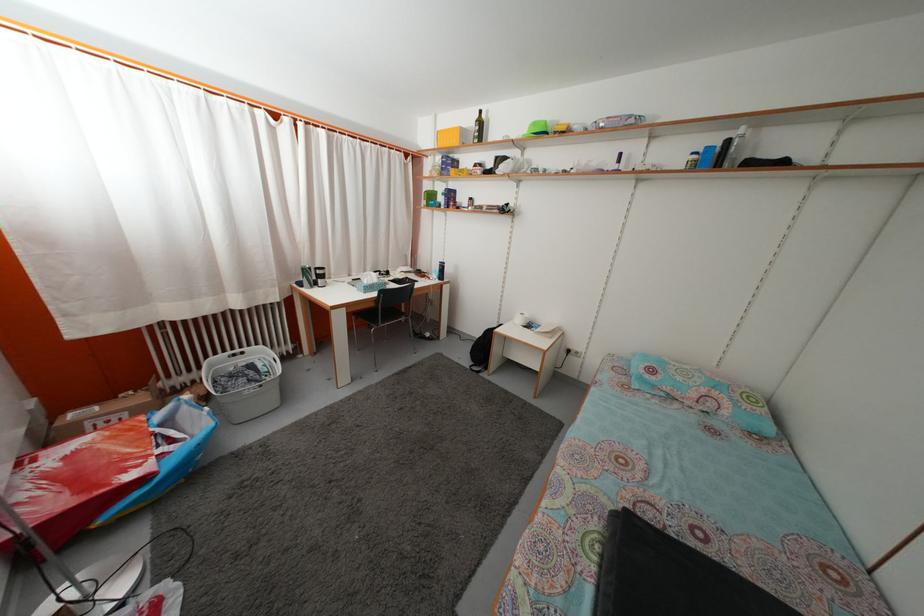
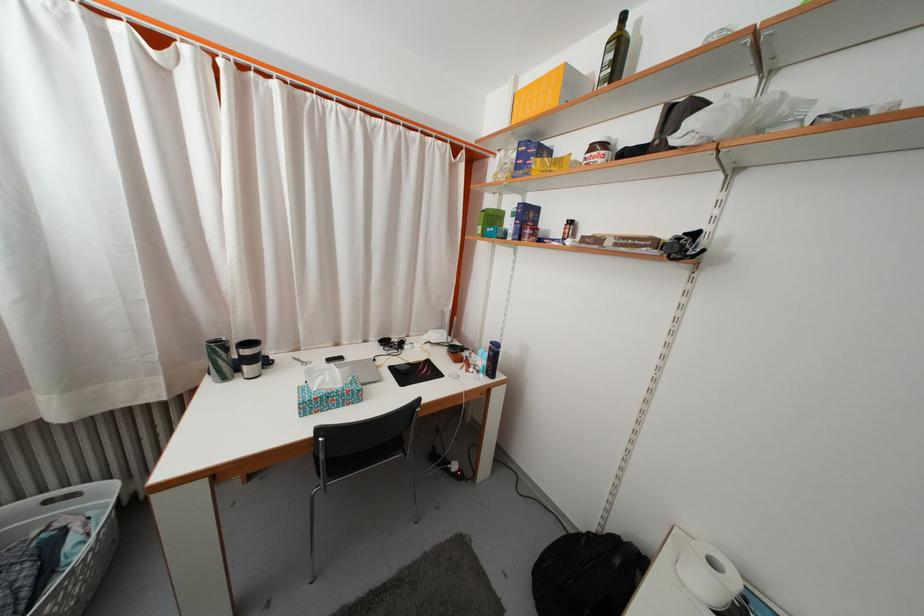
Find the pixel in the second image that matches point (447, 177) in the first image.

(523, 175)